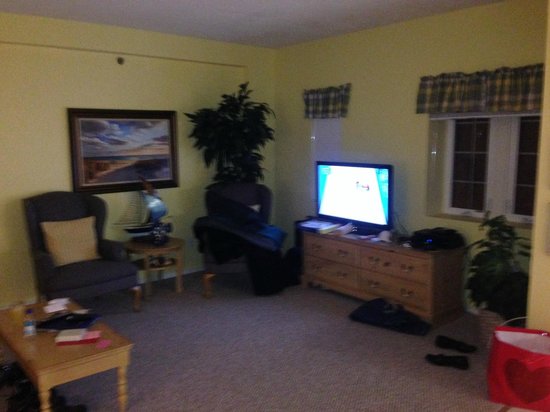
Locate an element on the screen. This screenshot has height=412, width=550. painting is located at coordinates (98, 140).